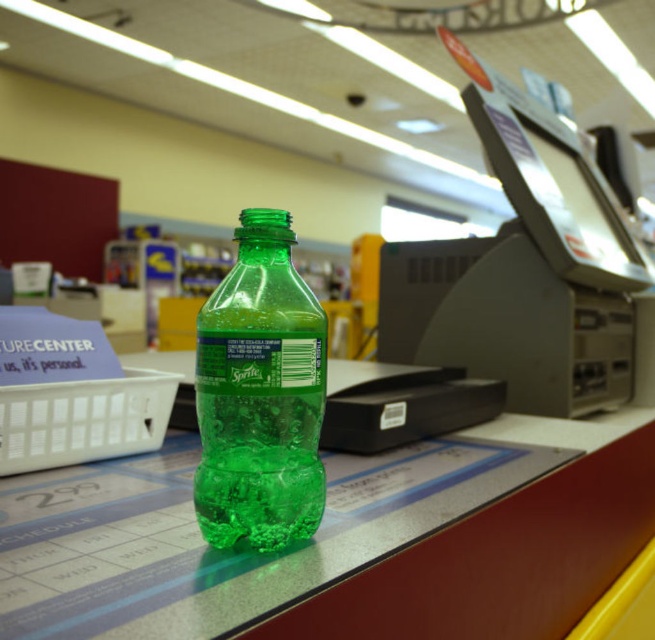
Is the position of translucent plastic bottle at center less distant than that of green translucent plastic bottle at center?

Yes, translucent plastic bottle at center is closer to the viewer.

Is translucent plastic bottle at center bigger than green translucent plastic bottle at center?

Indeed, translucent plastic bottle at center has a larger size compared to green translucent plastic bottle at center.

Locate an element on the screen. This screenshot has height=640, width=655. translucent plastic bottle at center is located at coordinates (259, 554).